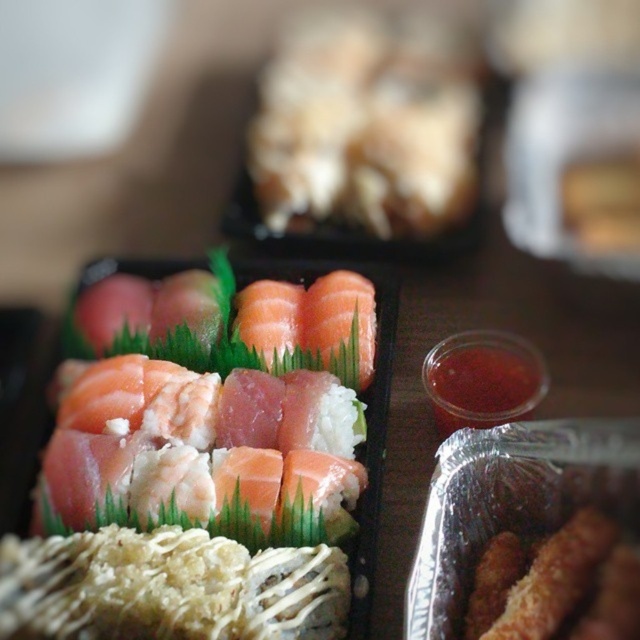
You are a sushi chef preparing to place a soy sauce dish between the pink raw fish at center and the slightly translucent salmon at upper center. The dish is 4 inches wide. Will it fit in the space between them?

The space between the pink raw fish at center and the slightly translucent salmon at upper center is 12.70 inches. Since the soy sauce dish is only 4 inches wide, it will fit comfortably in the space between them.

You are a food critic who just arrived at a sushi restaurant. You see the pink raw fish at center and the slightly translucent salmon at upper center on the platter. Which one is positioned higher up on the platter?

The slightly translucent salmon at upper center is positioned higher up on the platter than the pink raw fish at center.